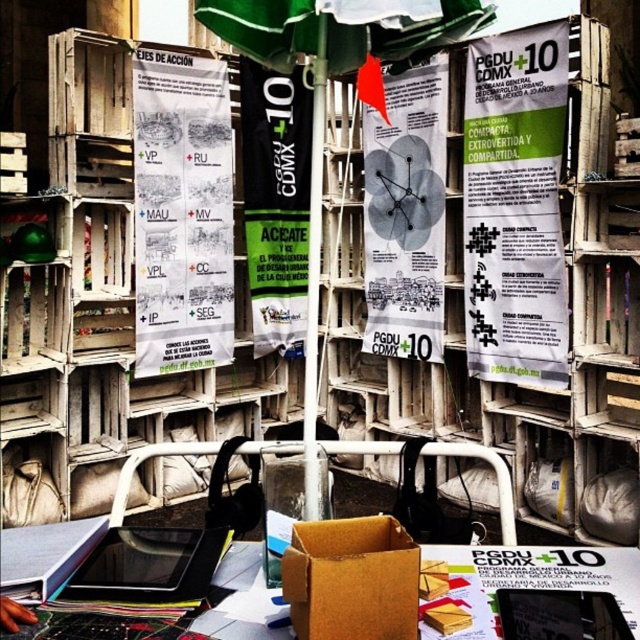
Between green fabric umbrella at center and brown cardboard box at center, which one is positioned higher?

green fabric umbrella at center is higher up.

Is point (316, 108) closer to camera compared to point (369, 596)?

No, it is not.

Locate an element on the screen. green fabric umbrella at center is located at coordinates (324, 100).

This screenshot has height=640, width=640. Describe the element at coordinates (515, 205) in the screenshot. I see `white paper poster at upper right` at that location.

Who is taller, white paper poster at upper right or brown cardboard box at center?

With more height is white paper poster at upper right.

Between point (474, 116) and point (312, 605), which one is positioned behind?

The point (474, 116) is more distant.

Find the location of `white paper poster at upper right`. white paper poster at upper right is located at coordinates (515, 205).

Who is taller, white paper poster at center or black fabric banner at center?

Standing taller between the two is black fabric banner at center.

Who is positioned more to the left, white paper poster at center or black fabric banner at center?

black fabric banner at center

Which is behind, point (419, 340) or point (252, 236)?

The point (252, 236) is behind.

Identify the location of white paper poster at center. (404, 214).